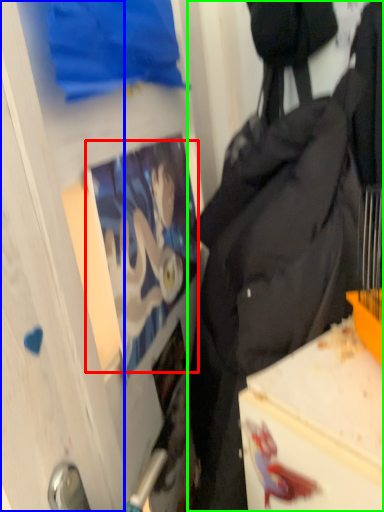
Question: Which object is positioned farthest from person (highlighted by a red box)? Select from glass door (highlighted by a blue box) and backpack (highlighted by a green box).

Choices:
 (A) glass door
 (B) backpack

Answer: (A)